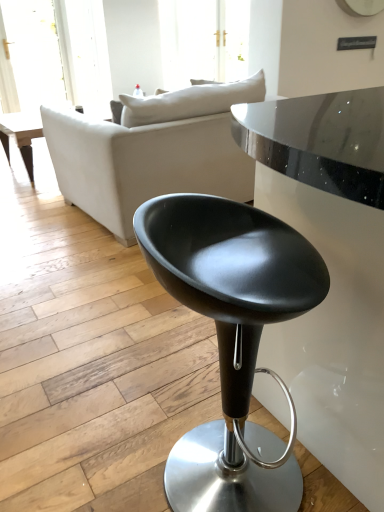
The height and width of the screenshot is (512, 384). Describe the element at coordinates (152, 152) in the screenshot. I see `matte white couch at center` at that location.

You are a GUI agent. You are given a task and a screenshot of the screen. Output one action in this format:
    pyautogui.click(x=<x>, y=<y>)
    Task: Click on the matte white couch at center
    Image resolution: width=384 pixels, height=512 pixels.
    Given the screenshot: What is the action you would take?
    pyautogui.click(x=152, y=152)

The width and height of the screenshot is (384, 512). What do you see at coordinates (231, 337) in the screenshot?
I see `matte black stool at center` at bounding box center [231, 337].

Where is `matte black stool at center`? This screenshot has height=512, width=384. matte black stool at center is located at coordinates (231, 337).

Where is `matte white couch at center`? This screenshot has height=512, width=384. matte white couch at center is located at coordinates (152, 152).

Can you confirm if matte white couch at center is positioned to the right of matte black stool at center?

No.

Is matte white couch at center in front of matte black stool at center?

No, it is not.

Considering the points (158, 148) and (268, 444), which point is in front, point (158, 148) or point (268, 444)?

The point (268, 444) is closer to the camera.

From the image's perspective, would you say matte white couch at center is shown under matte black stool at center?

No, from the image's perspective, matte white couch at center is not beneath matte black stool at center.

From a real-world perspective, between matte white couch at center and matte black stool at center, who is vertically higher?

matte white couch at center.

Looking at this image, which of these two, matte white couch at center or matte black stool at center, is thinner?

matte black stool at center.

Does matte white couch at center have a greater height compared to matte black stool at center?

Indeed, matte white couch at center has a greater height compared to matte black stool at center.

Who is bigger, matte white couch at center or matte black stool at center?

With larger size is matte white couch at center.

Could matte black stool at center be considered to be inside matte white couch at center?

Actually, matte black stool at center is outside matte white couch at center.

Would you consider matte white couch at center to be distant from matte black stool at center?

Yes, matte white couch at center and matte black stool at center are quite far apart.

Is matte white couch at center facing away from matte black stool at center?

Yes, matte black stool at center is at the back of matte white couch at center.

How many degrees apart are the facing directions of matte white couch at center and matte black stool at center?

The facing directions of matte white couch at center and matte black stool at center are 132 degrees apart.

I want to click on studio couch to the left of matte black stool at center, so click(152, 152).

Does matte black stool at center appear on the left side of matte white couch at center?

No.

Which is behind, matte black stool at center or matte white couch at center?

matte white couch at center is behind.

Does point (189, 467) lie in front of point (181, 183)?

Yes, it is in front of point (181, 183).

From the image's perspective, who appears lower, matte black stool at center or matte white couch at center?

matte black stool at center, from the image's perspective.

From a real-world perspective, who is located higher, matte black stool at center or matte white couch at center?

In real-world perspective, matte white couch at center is above.

Does matte black stool at center have a lesser width compared to matte white couch at center?

Yes, matte black stool at center is thinner than matte white couch at center.

Which of these two, matte black stool at center or matte white couch at center, stands taller?

matte white couch at center.

Based on the photo, is matte black stool at center bigger than matte white couch at center?

No.

Does matte black stool at center contain matte white couch at center?

No, matte white couch at center is located outside of matte black stool at center.

Is matte black stool at center directly adjacent to matte white couch at center?

No, matte black stool at center is not with matte white couch at center.

Is matte black stool at center turned away from matte white couch at center?

No, matte black stool at center is not facing the opposite direction of matte white couch at center.

Where is `studio couch lying on the left of matte black stool at center`? This screenshot has width=384, height=512. studio couch lying on the left of matte black stool at center is located at coordinates (152, 152).

What are the coordinates of `studio couch that appears above the matte black stool at center (from the image's perspective)` in the screenshot? It's located at (152, 152).

Locate an element on the screen. The image size is (384, 512). studio couch on the left of matte black stool at center is located at coordinates (152, 152).